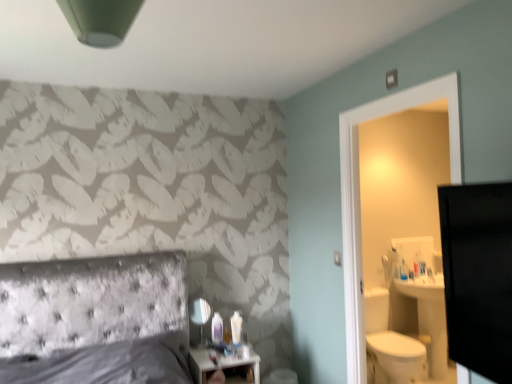
Question: Is point (200, 354) closer or farther from the camera than point (241, 339)?

Choices:
 (A) farther
 (B) closer

Answer: (B)

Question: From the image's perspective, is white glossy nightstand at lower center positioned above or below white plastic lotion at center?

Choices:
 (A) above
 (B) below

Answer: (B)

Question: Which object is the farthest from the matte glass mirror at center?

Choices:
 (A) white plastic lotion at center
 (B) white glossy nightstand at lower center

Answer: (A)

Question: Considering the real-world distances, which object is closest to the matte glass mirror at center?

Choices:
 (A) white glossy nightstand at lower center
 (B) white plastic lotion at center

Answer: (A)